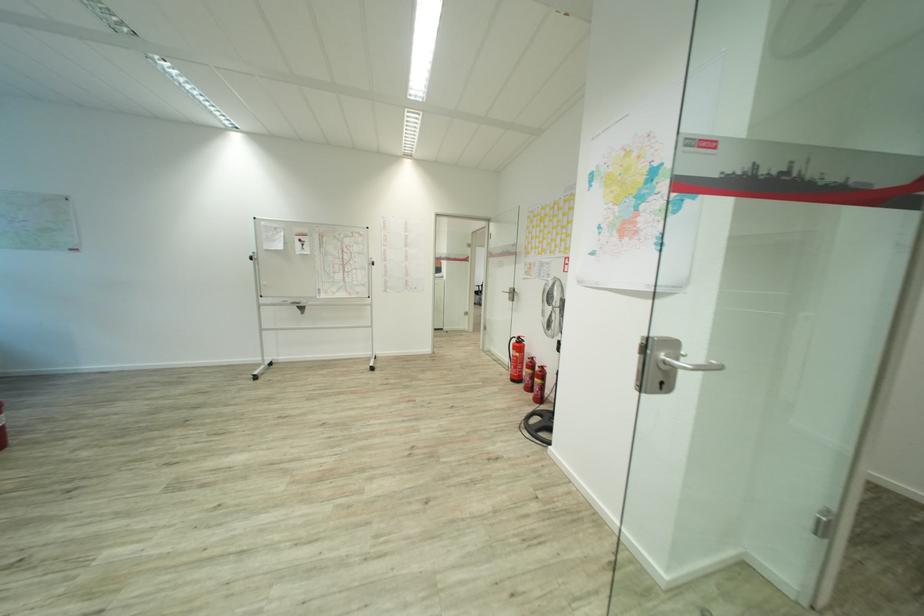
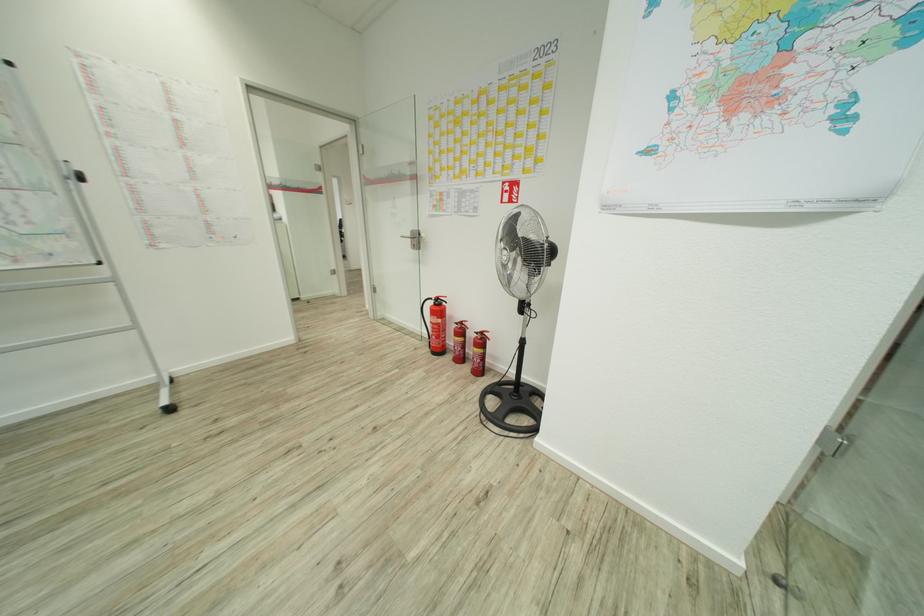
In the second image, find the point that corresponds to (x=371, y=368) in the first image.

(169, 408)